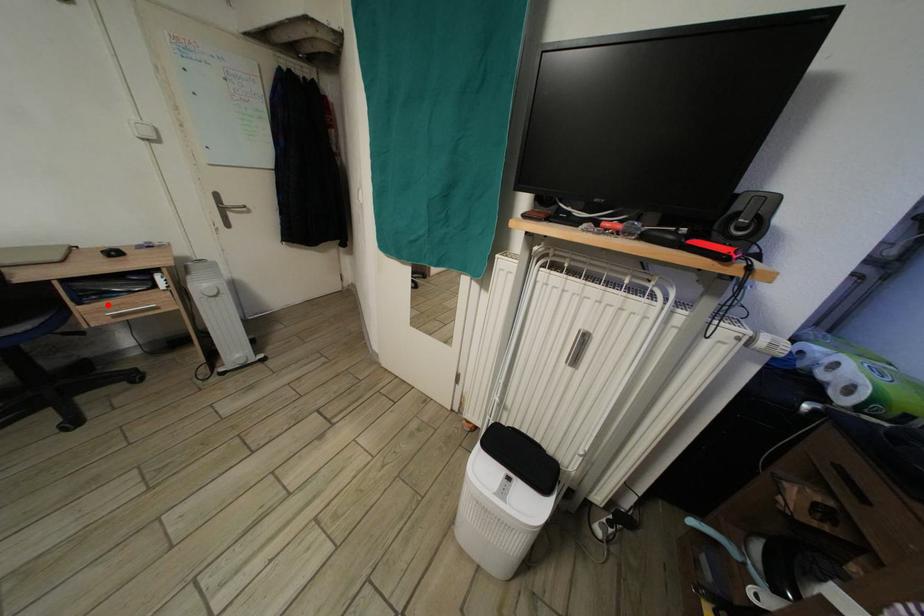
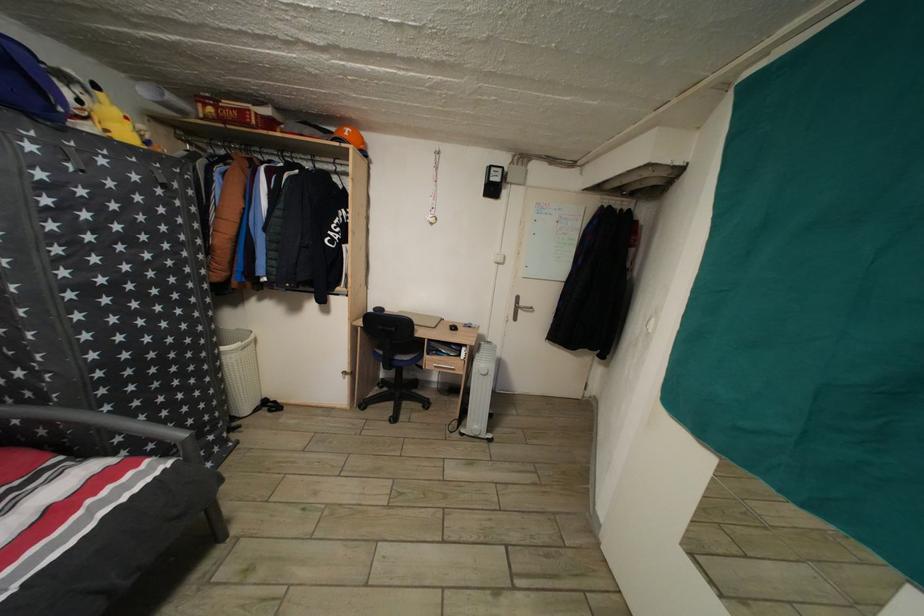
Where in the second image is the point corresponding to the highlighted location from the first image?

(443, 361)